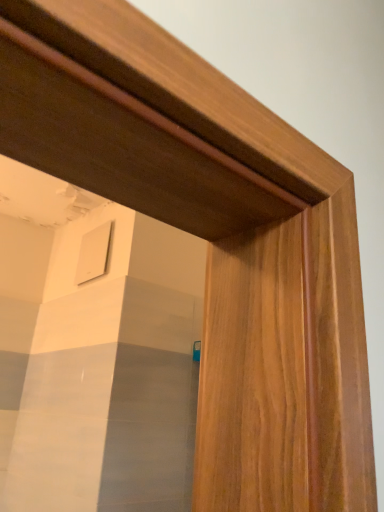
Question: Should I look upward or downward to see white matte vent at upper center?

Choices:
 (A) up
 (B) down

Answer: (B)